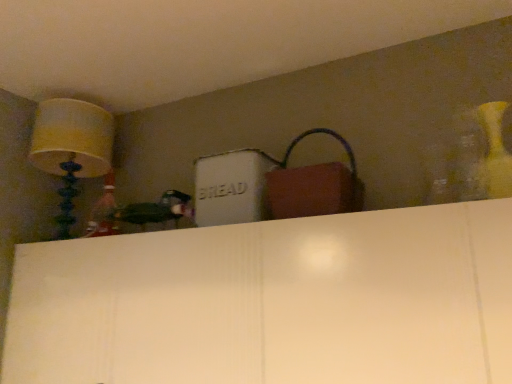
Question: From the image's perspective, is matte yellow lampshade at upper left above or below matte brown handbag at upper center?

Choices:
 (A) above
 (B) below

Answer: (A)

Question: From a real-world perspective, is matte yellow lampshade at upper left physically located above or below matte brown handbag at upper center?

Choices:
 (A) below
 (B) above

Answer: (B)

Question: Is matte yellow lampshade at upper left situated inside matte brown handbag at upper center or outside?

Choices:
 (A) outside
 (B) inside

Answer: (A)

Question: From their relative heights in the image, would you say matte brown handbag at upper center is taller or shorter than matte yellow lampshade at upper left?

Choices:
 (A) tall
 (B) short

Answer: (B)

Question: From a real-world perspective, relative to matte yellow lampshade at upper left, is matte brown handbag at upper center vertically above or below?

Choices:
 (A) below
 (B) above

Answer: (A)

Question: In the image, is matte brown handbag at upper center positioned in front of or behind matte yellow lampshade at upper left?

Choices:
 (A) front
 (B) behind

Answer: (A)

Question: Which is correct: matte brown handbag at upper center is inside matte yellow lampshade at upper left, or outside of it?

Choices:
 (A) outside
 (B) inside

Answer: (A)